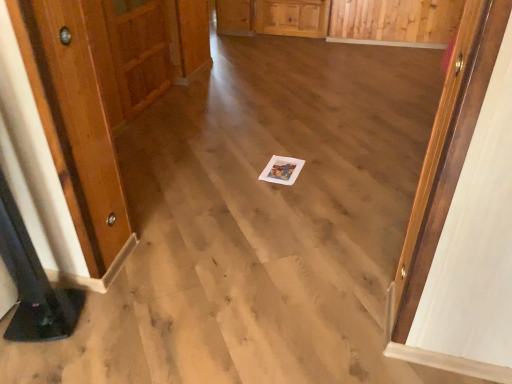
You are a GUI agent. You are given a task and a screenshot of the screen. Output one action in this format:
    pyautogui.click(x=<x>, y=<y>)
    Task: Click on the wooden barn door at left
    The height and width of the screenshot is (384, 512).
    Given the screenshot: What is the action you would take?
    pyautogui.click(x=138, y=51)

The image size is (512, 384). Describe the element at coordinates (138, 51) in the screenshot. I see `wooden barn door at left` at that location.

Based on the photo, measure the distance between wooden barn door at left and camera.

wooden barn door at left and camera are 8.47 feet apart from each other.

In order to face wooden barn door at left, should I rotate leftwards or rightwards?

Turn left by 14.666 degrees to look at wooden barn door at left.

Identify the location of wooden barn door at left. (138, 51).